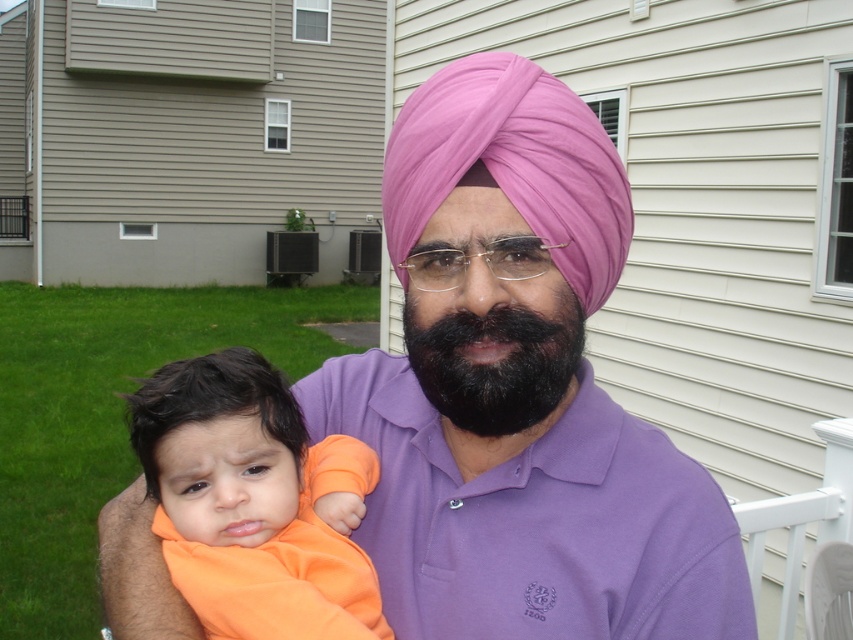
Question: Which point is closer to the camera?

Choices:
 (A) (403, 616)
 (B) (500, 140)
 (C) (368, 449)
 (D) (476, 406)

Answer: (B)

Question: Can you confirm if orange fleece at center is positioned above blackhairbeard at center?

Choices:
 (A) yes
 (B) no

Answer: (B)

Question: Does purple cotton polo shirt at center come behind blackhairbeard at center?

Choices:
 (A) yes
 (B) no

Answer: (A)

Question: Does purple matte turban at center have a larger size compared to purple cotton polo shirt at center?

Choices:
 (A) no
 (B) yes

Answer: (B)

Question: Which is nearer to the orange fleece at center?

Choices:
 (A) blackhairbeard at center
 (B) purple cotton polo shirt at center
 (C) pink fabric turban at center
 (D) purple matte turban at center

Answer: (B)

Question: Estimate the real-world distances between objects in this image. Which object is farther from the purple matte turban at center?

Choices:
 (A) pink fabric turban at center
 (B) blackhairbeard at center
 (C) orange fleece at center

Answer: (C)